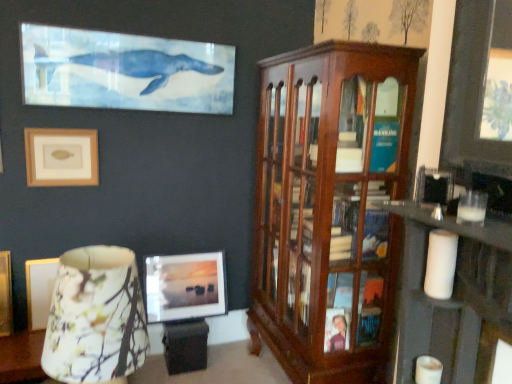
Question: From a real-world perspective, does beige matte picture frame at upper left, the first picture frame when ordered from front to back, stand above floral fabric lampshade at lower left?

Choices:
 (A) no
 (B) yes

Answer: (B)

Question: Is beige matte picture frame at upper left, which is the second picture frame from bottom to top, thinner than floral fabric lampshade at lower left?

Choices:
 (A) yes
 (B) no

Answer: (A)

Question: Is beige matte picture frame at upper left, placed as the first picture frame when sorted from top to bottom, located outside floral fabric lampshade at lower left?

Choices:
 (A) yes
 (B) no

Answer: (A)

Question: Is beige matte picture frame at upper left, acting as the second picture frame starting from the right, looking in the opposite direction of floral fabric lampshade at lower left?

Choices:
 (A) no
 (B) yes

Answer: (A)

Question: Is beige matte picture frame at upper left, the first picture frame when ordered from front to back, behind floral fabric lampshade at lower left?

Choices:
 (A) yes
 (B) no

Answer: (A)

Question: Considering the relative sizes of beige matte picture frame at upper left, acting as the second picture frame starting from the right, and floral fabric lampshade at lower left in the image provided, is beige matte picture frame at upper left, acting as the second picture frame starting from the right, wider than floral fabric lampshade at lower left?

Choices:
 (A) no
 (B) yes

Answer: (A)

Question: Can you confirm if floral fabric lampshade at lower left is wider than beige matte picture frame at upper left, which is the second picture frame from bottom to top?

Choices:
 (A) no
 (B) yes

Answer: (B)

Question: Is floral fabric lampshade at lower left bigger than beige matte picture frame at upper left, acting as the second picture frame starting from the right?

Choices:
 (A) no
 (B) yes

Answer: (B)

Question: From the image's perspective, is floral fabric lampshade at lower left located beneath beige matte picture frame at upper left, placed as the first picture frame when sorted from top to bottom?

Choices:
 (A) no
 (B) yes

Answer: (B)

Question: Can you confirm if floral fabric lampshade at lower left is positioned to the right of beige matte picture frame at upper left, the 1th picture frame when ordered from left to right?

Choices:
 (A) no
 (B) yes

Answer: (B)

Question: From the image's perspective, is floral fabric lampshade at lower left over beige matte picture frame at upper left, the first picture frame when ordered from front to back?

Choices:
 (A) yes
 (B) no

Answer: (B)

Question: Is floral fabric lampshade at lower left outside beige matte picture frame at upper left, the first picture frame when ordered from front to back?

Choices:
 (A) no
 (B) yes

Answer: (B)

Question: Considering the relative positions of matte glass picture frame at center, arranged as the 2th picture frame when viewed from the front, and floral fabric lampshade at lower left in the image provided, is matte glass picture frame at center, arranged as the 2th picture frame when viewed from the front, behind floral fabric lampshade at lower left?

Choices:
 (A) no
 (B) yes

Answer: (B)